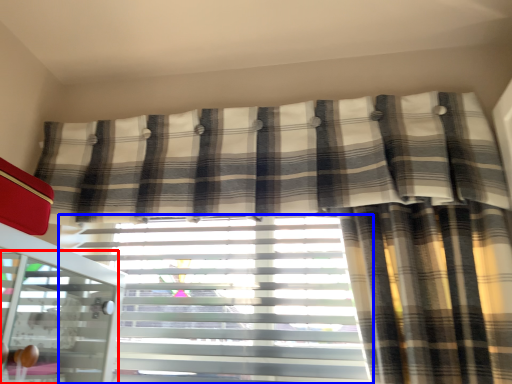
Question: Which object appears closest to the camera in this image, screen door (highlighted by a red box) or window blind (highlighted by a blue box)?

Choices:
 (A) screen door
 (B) window blind

Answer: (A)